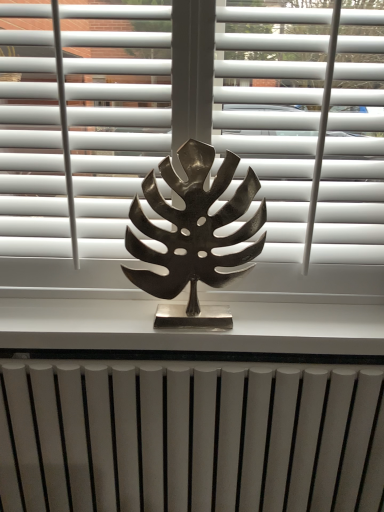
What do you see at coordinates (193, 329) in the screenshot?
I see `metallic silver at center` at bounding box center [193, 329].

You are a GUI agent. You are given a task and a screenshot of the screen. Output one action in this format:
    pyautogui.click(x=<x>, y=<y>)
    Task: Click on the bronze leaf at center
    This screenshot has width=384, height=512.
    Given the screenshot: What is the action you would take?
    pyautogui.click(x=193, y=234)

What is the approximate height of white matte blind at upper center?

white matte blind at upper center is 22.38 inches tall.

At what (x,y) coordinates should I click in order to perform the action: click on metallic silver at center. Please return your answer as a coordinate pair (x, y). Looking at the image, I should click on (193, 329).

From a real-world perspective, is bronze leaf at center positioned under white matte blind at upper center based on gravity?

Indeed, from a real-world perspective, bronze leaf at center is positioned beneath white matte blind at upper center.

Are bronze leaf at center and white matte blind at upper center beside each other?

No, bronze leaf at center is not beside white matte blind at upper center.

Is bronze leaf at center facing away from white matte blind at upper center?

That's not correct — bronze leaf at center is not looking away from white matte blind at upper center.

Find the location of a particular element. blind behind the bronze leaf at center is located at coordinates (306, 124).

Are metallic silver leaf at center and bronze leaf at center beside each other?

metallic silver leaf at center is not next to bronze leaf at center, and they're not touching.

Can you confirm if metallic silver leaf at center is positioned to the right of bronze leaf at center?

Indeed, metallic silver leaf at center is positioned on the right side of bronze leaf at center.

Considering the relative sizes of metallic silver leaf at center and bronze leaf at center in the image provided, is metallic silver leaf at center thinner than bronze leaf at center?

Correct, the width of metallic silver leaf at center is less than that of bronze leaf at center.

In terms of size, does metallic silver leaf at center appear bigger or smaller than bronze leaf at center?

Clearly, metallic silver leaf at center is larger in size than bronze leaf at center.

Is metallic silver at center turned away from bronze leaf at center?

No, metallic silver at center's orientation is not away from bronze leaf at center.

From a real-world perspective, is metallic silver at center on top of bronze leaf at center?

Incorrect, from a real-world perspective, metallic silver at center is lower than bronze leaf at center.

Is metallic silver at center far from bronze leaf at center?

No.

Considering the relative positions of metallic silver at center and bronze leaf at center in the image provided, is metallic silver at center to the right of bronze leaf at center from the viewer's perspective?

In fact, metallic silver at center is to the left of bronze leaf at center.

Considering the points (299, 76) and (146, 188), which point is behind, point (299, 76) or point (146, 188)?

Point (146, 188)

What's the angular difference between white matte blind at upper center and bronze leaf at center's facing directions?

white matte blind at upper center and bronze leaf at center are facing 0.00413 degrees away from each other.

Locate an element on the screen. The width and height of the screenshot is (384, 512). bronze statue in front of the white matte blind at upper center is located at coordinates (193, 234).

Is white matte blind at upper center positioned with its back to bronze leaf at center?

white matte blind at upper center does not have its back to bronze leaf at center.

Considering the sizes of white matte radiator at bottom and metallic silver at center in the image, is white matte radiator at bottom taller or shorter than metallic silver at center?

white matte radiator at bottom is taller than metallic silver at center.

Is white matte radiator at bottom next to metallic silver at center?

No, white matte radiator at bottom is not making contact with metallic silver at center.

From the image's perspective, is white matte radiator at bottom beneath metallic silver at center?

Yes.

Does metallic silver at center have a larger size compared to white matte blind at upper center?

Actually, metallic silver at center might be smaller than white matte blind at upper center.

Is metallic silver at center outside of white matte blind at upper center?

Yes, metallic silver at center is located beyond the bounds of white matte blind at upper center.

Based on the photo, from a real-world perspective, who is located higher, metallic silver at center or white matte blind at upper center?

white matte blind at upper center is physically above.

Does metallic silver at center appear on the left side of white matte blind at upper center?

Indeed, metallic silver at center is positioned on the left side of white matte blind at upper center.

Is white matte blind at upper center completely or partially inside white matte radiator at bottom?

No, white matte radiator at bottom does not contain white matte blind at upper center.

Is the surface of white matte radiator at bottom in direct contact with white matte blind at upper center?

No, white matte radiator at bottom is not in contact with white matte blind at upper center.

How different are the orientations of white matte radiator at bottom and white matte blind at upper center in degrees?

The angle between the facing direction of white matte radiator at bottom and the facing direction of white matte blind at upper center is 0.00148 degrees.

From a real-world perspective, between white matte radiator at bottom and white matte blind at upper center, who is vertically higher?

In real-world perspective, white matte blind at upper center is above.

Locate an element on the screen. blind behind the bronze leaf at center is located at coordinates (306, 124).

This screenshot has height=512, width=384. I want to click on window blind on the right of bronze leaf at center, so click(x=79, y=141).

In the scene shown: Which object lies nearer to the anchor point bronze leaf at center, white matte radiator at bottom or metallic silver at center?

Among the two, metallic silver at center is located nearer to bronze leaf at center.

Considering their positions, is bronze leaf at center positioned closer to white matte radiator at bottom than metallic silver at center?

metallic silver at center is closer to white matte radiator at bottom.

Looking at the image, which one is located closer to metallic silver leaf at center, metallic silver at center or white matte blind at upper center?

Based on the image, white matte blind at upper center appears to be nearer to metallic silver leaf at center.

Consider the image. When comparing their distances from metallic silver leaf at center, does bronze leaf at center or white matte blind at upper center seem closer?

Based on the image, white matte blind at upper center appears to be nearer to metallic silver leaf at center.

Based on their spatial positions, is white matte blind at upper center or white matte radiator at bottom further from bronze leaf at center?

Based on the image, white matte radiator at bottom appears to be further to bronze leaf at center.

Estimate the real-world distances between objects in this image. Which object is further from white matte blind at upper center, metallic silver at center or bronze leaf at center?

The object further to white matte blind at upper center is metallic silver at center.

Estimate the real-world distances between objects in this image. Which object is further from white matte blind at upper center, white matte radiator at bottom or metallic silver leaf at center?

The object further to white matte blind at upper center is white matte radiator at bottom.

Based on their spatial positions, is white matte blind at upper center or metallic silver at center closer to white matte radiator at bottom?

metallic silver at center.

The image size is (384, 512). In order to click on bronze statue between metallic silver leaf at center and metallic silver at center vertically in this screenshot , I will do `click(193, 234)`.

Find the location of a particular element. window blind between bronze leaf at center and white matte blind at upper center from left to right is located at coordinates (79, 141).

Locate an element on the screen. The height and width of the screenshot is (512, 384). window blind between white matte blind at upper center and white matte radiator at bottom vertically is located at coordinates (79, 141).

This screenshot has width=384, height=512. I want to click on bronze statue that lies between metallic silver leaf at center and white matte radiator at bottom from top to bottom, so point(193,234).